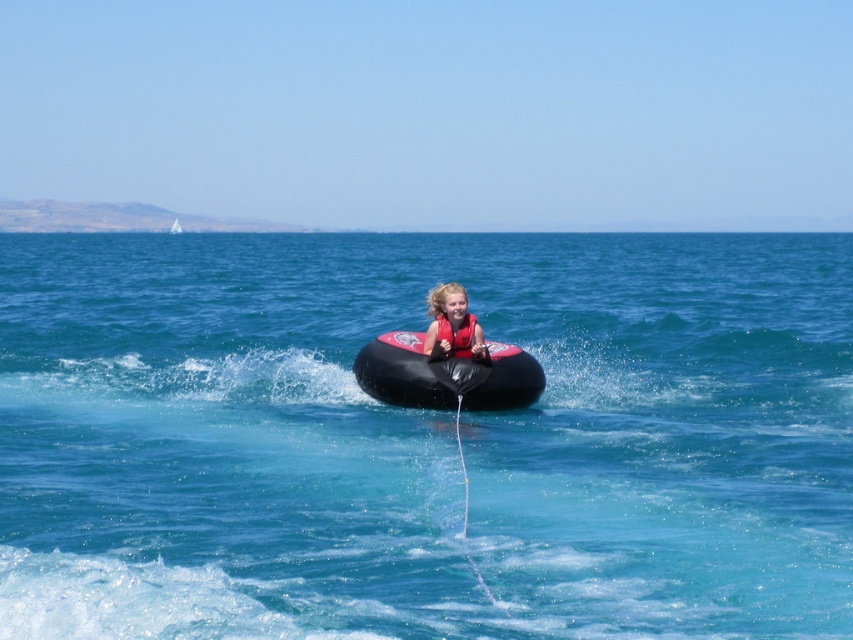
Between translucent rubber tube at center and black rubber tube at center, which one has less height?

black rubber tube at center

Is translucent rubber tube at center to the left of black rubber tube at center from the viewer's perspective?

Yes, translucent rubber tube at center is to the left of black rubber tube at center.

Image resolution: width=853 pixels, height=640 pixels. What do you see at coordinates (424, 438) in the screenshot?
I see `translucent rubber tube at center` at bounding box center [424, 438].

Where is `translucent rubber tube at center`? This screenshot has height=640, width=853. translucent rubber tube at center is located at coordinates (424, 438).

Can you confirm if black rubber tube at center is bigger than matte red life vest at center?

Yes.

Between black rubber tube at center and matte red life vest at center, which one has more height?

Standing taller between the two is matte red life vest at center.

Which is in front, point (447, 380) or point (450, 285)?

Point (447, 380) is more forward.

Identify the location of black rubber tube at center. (445, 376).

Is translucent rubber tube at center smaller than red matte life jacket at center?

No, translucent rubber tube at center is not smaller than red matte life jacket at center.

Is translucent rubber tube at center thinner than red matte life jacket at center?

In fact, translucent rubber tube at center might be wider than red matte life jacket at center.

Does point (312, 236) lie behind point (456, 337)?

Yes, point (312, 236) is farther from viewer.

Where is `translucent rubber tube at center`? Image resolution: width=853 pixels, height=640 pixels. translucent rubber tube at center is located at coordinates (424, 438).